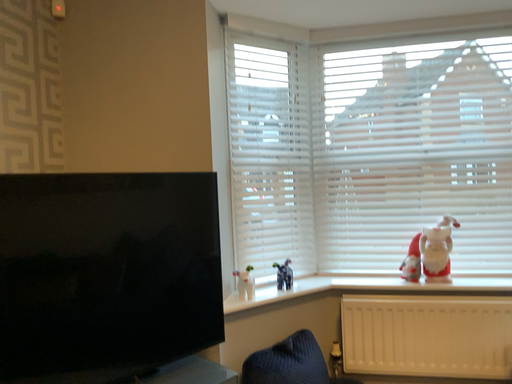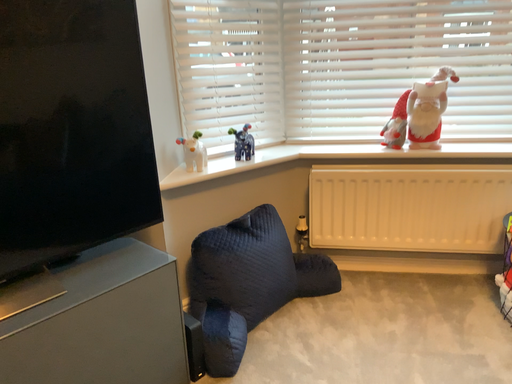
Question: How did the camera likely rotate when shooting the video?

Choices:
 (A) rotated downward
 (B) rotated upward

Answer: (A)